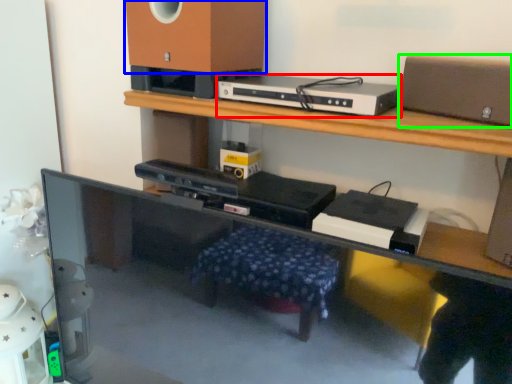
Question: Which is farther away from gadget (highlighted by a red box)? speaker (highlighted by a blue box) or speaker (highlighted by a green box)?

Choices:
 (A) speaker
 (B) speaker

Answer: (B)